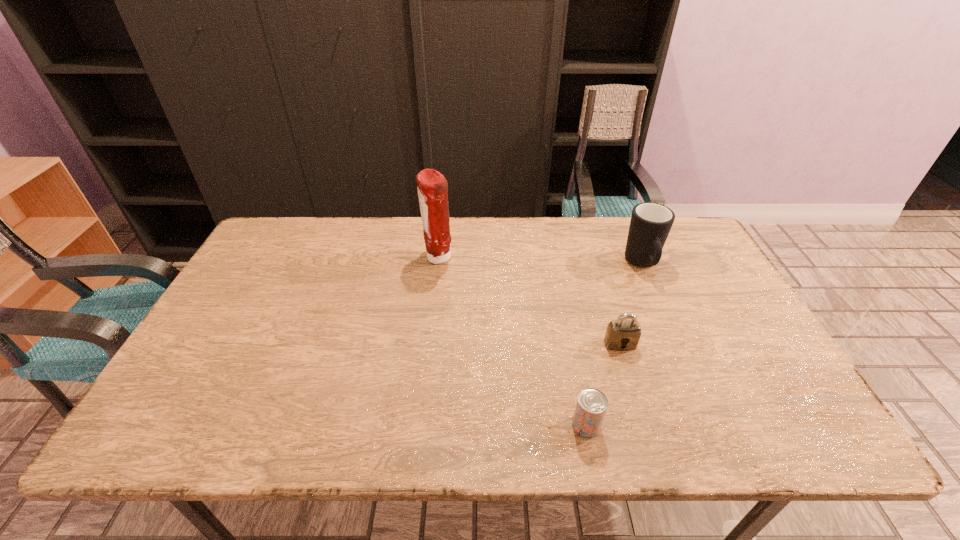
You are a GUI agent. You are given a task and a screenshot of the screen. Output one action in this format:
    pyautogui.click(x=<x>, y=<y>)
    Task: Click on the tallest object
    The height and width of the screenshot is (540, 960).
    Given the screenshot: What is the action you would take?
    pyautogui.click(x=432, y=187)

I want to click on the leftmost object, so click(x=432, y=187).

This screenshot has width=960, height=540. In order to click on mug in this screenshot , I will do `click(650, 224)`.

Find the location of a particular element. the second tallest object is located at coordinates (650, 224).

The image size is (960, 540). Identify the location of padlock. pos(622,334).

At what (x,y) coordinates should I click in order to perform the action: click on the third tallest object. Please return your answer as a coordinate pair (x, y). The image size is (960, 540). Looking at the image, I should click on (622, 334).

Where is `the second object from left to right`? This screenshot has width=960, height=540. the second object from left to right is located at coordinates (591, 406).

This screenshot has width=960, height=540. I want to click on the shortest object, so click(591, 406).

Where is `vacant space positioned 0.370m on the left of the condiment`? The image size is (960, 540). vacant space positioned 0.370m on the left of the condiment is located at coordinates (305, 258).

You are a GUI agent. You are given a task and a screenshot of the screen. Output one action in this format:
    pyautogui.click(x=<x>, y=<y>)
    Task: Click on the vacant space located 0.270m on the side of the second tallest object with the handle
    
    Given the screenshot: What is the action you would take?
    pyautogui.click(x=683, y=356)